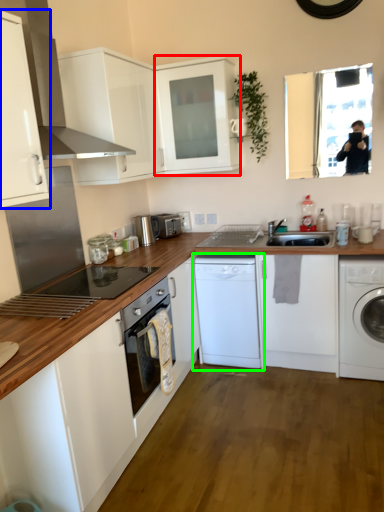
Question: Estimate the real-world distances between objects in this image. Which object is farther from cabinetry (highlighted by a red box), cabinetry (highlighted by a blue box) or washing machine (highlighted by a green box)?

Choices:
 (A) cabinetry
 (B) washing machine

Answer: (A)